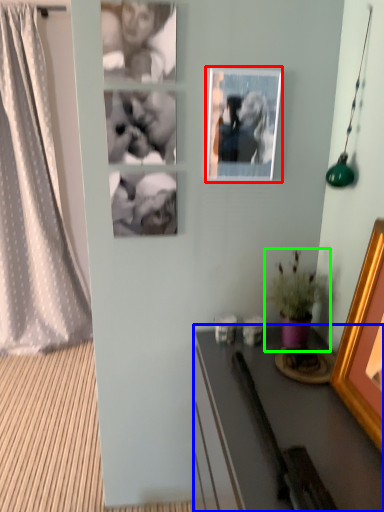
Question: Based on their relative distances, which object is farther from picture frame (highlighted by a red box)? Choose from desk (highlighted by a blue box) and houseplant (highlighted by a green box).

Choices:
 (A) desk
 (B) houseplant

Answer: (A)